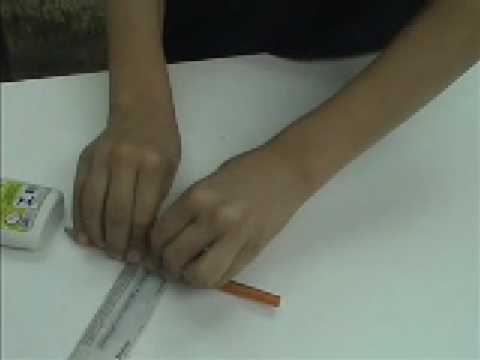
Find the location of a particular element. table edge is located at coordinates (49, 76), (13, 80), (79, 73), (171, 64), (205, 59), (230, 56).